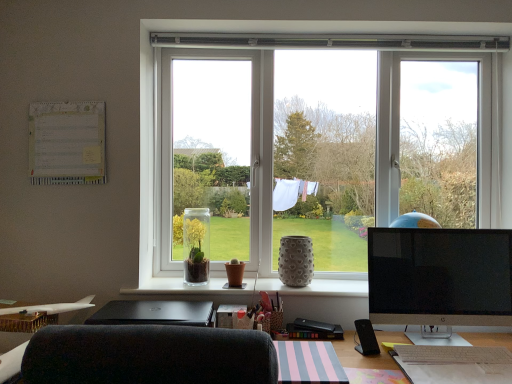
Question: Choose the correct answer: Is black glossy monitor at right inside brown matte vase at center, the second vase positioned from the right, or outside it?

Choices:
 (A) outside
 (B) inside

Answer: (A)

Question: From the image's perspective, is black glossy monitor at right positioned above or below brown matte vase at center, which is counted as the second vase, starting from the left?

Choices:
 (A) below
 (B) above

Answer: (A)

Question: Which is farther from the white plastic keyboard at lower right?

Choices:
 (A) brown matte vase at center, the second vase positioned from the right
 (B) white matte airplane at lower left
 (C) matte black stapler at lower center
 (D) white textured vase at center
 (E) clear glass vase at center, which appears as the first vase when viewed from the left

Answer: (B)

Question: Which of these objects is positioned closest to the pink striped notepad at lower center?

Choices:
 (A) white textured vase at center
 (B) black glossy monitor at right
 (C) gray textured vase at center, which is the 1th vase from right to left
 (D) clear glass vase at center, which appears as the first vase when viewed from the left
 (E) white plastic keyboard at lower right

Answer: (E)